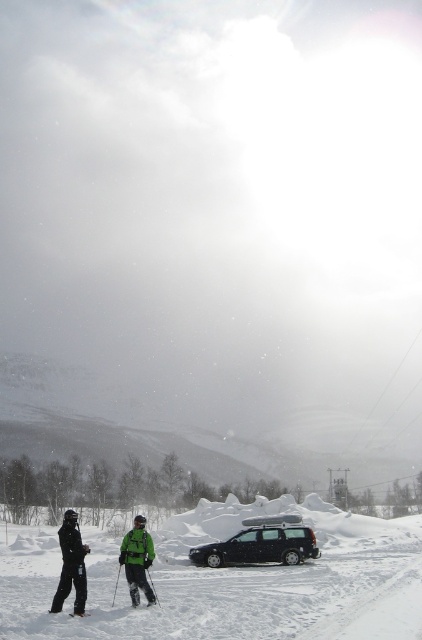
Question: Which point is closer to the camera taking this photo?

Choices:
 (A) (83, 612)
 (B) (256, 538)
 (C) (67, 580)
 (D) (294, 589)

Answer: (A)

Question: Does black matte station wagon at center lie in front of black matte ski at lower left?

Choices:
 (A) yes
 (B) no

Answer: (B)

Question: Among these objects, which one is farthest from the camera?

Choices:
 (A) black matte ski suit at left
 (B) white fluffy snow at lower center
 (C) black matte ski at lower left

Answer: (A)

Question: Where is white fluffy snow at lower center located in relation to black matte station wagon at center in the image?

Choices:
 (A) below
 (B) above

Answer: (A)

Question: Which of these objects is positioned farthest from the white fluffy snow at lower center?

Choices:
 (A) black matte station wagon at center
 (B) black matte ski at lower center
 (C) black ski suit at lower center

Answer: (B)

Question: Is green fabric jacket at lower center positioned before black matte ski at lower center?

Choices:
 (A) no
 (B) yes

Answer: (A)